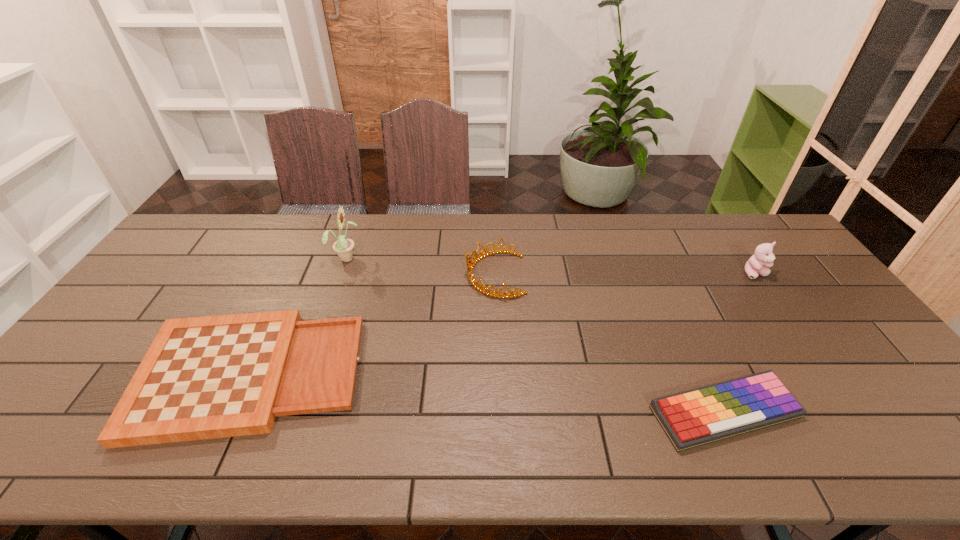
In order to click on free space located on the front-facing side of the third object from left to right in this screenshot , I will do `click(383, 274)`.

Image resolution: width=960 pixels, height=540 pixels. I want to click on free region located 0.310m on the front-facing side of the third object from left to right, so click(367, 274).

Locate an element on the screen. free spot located 0.210m on the back of the computer keyboard is located at coordinates (681, 316).

This screenshot has height=540, width=960. Identify the location of vacant space situated 0.130m on the back of the gameboard. (291, 287).

Locate an element on the screen. sunflower located in the far edge section of the desktop is located at coordinates (343, 246).

Locate an element on the screen. tiara at the far edge is located at coordinates (470, 264).

Locate an element on the screen. computer keyboard at the near edge is located at coordinates (700, 416).

This screenshot has height=540, width=960. In order to click on gameboard positioned at the near edge in this screenshot , I will do `click(209, 377)`.

This screenshot has height=540, width=960. What are the coordinates of `object at the right edge` in the screenshot? It's located at (763, 256).

In the image, there is a desktop. Identify the location of vacant space at the far edge. (325, 247).